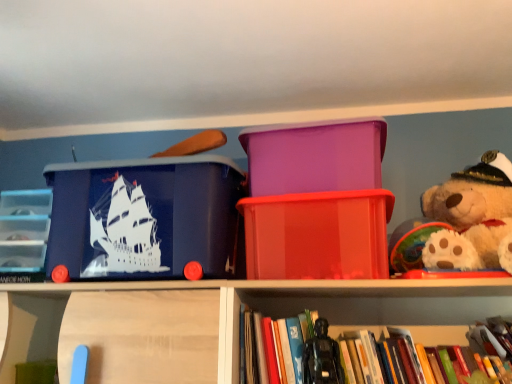
Measure the distance between black plastic action figure at lower center and camera.

The distance of black plastic action figure at lower center from camera is 38.92 inches.

This screenshot has height=384, width=512. Describe the element at coordinates (24, 229) in the screenshot. I see `clear plastic drawers at left` at that location.

In the scene shown: Measure the distance between point (208, 234) and camera.

1.08 meters.

In order to face purple plastic container at center, the second storage box viewed from the right, should I rotate leftwards or rightwards?

You should look right and rotate roughly 8.104 degrees.

Where is `purple plastic container at center, the second storage box positioned from the left`? Image resolution: width=512 pixels, height=384 pixels. purple plastic container at center, the second storage box positioned from the left is located at coordinates (315, 156).

The image size is (512, 384). I want to click on translucent red plastic container at center, the third storage box from the left, so click(x=317, y=235).

From the image's perspective, would you say hardcover book at center is positioned over translucent red plastic container at center, the third storage box from the left?

No.

Is hardcover book at center oriented away from translucent red plastic container at center, the third storage box from the left?

No, hardcover book at center's orientation is not away from translucent red plastic container at center, the third storage box from the left.

Is point (459, 333) closer to camera compared to point (318, 262)?

That is False.

From a real-world perspective, which is physically below, hardcover book at center or matte blue plastic storage box at left, the 1th storage box from the left?

hardcover book at center.

Looking at this image, is hardcover book at center not within matte blue plastic storage box at left, which is counted as the 3th storage box, starting from the right?

Yes, hardcover book at center is outside of matte blue plastic storage box at left, which is counted as the 3th storage box, starting from the right.

Can you tell me how much hardcover book at center and matte blue plastic storage box at left, the 1th storage box from the left, differ in facing direction?

The angular difference between hardcover book at center and matte blue plastic storage box at left, the 1th storage box from the left, is 0.734 degrees.

Is hardcover book at center far from matte blue plastic storage box at left, the 1th storage box from the left?

hardcover book at center is actually quite close to matte blue plastic storage box at left, the 1th storage box from the left.

Does black plastic action figure at lower center have a larger size compared to hardcover book at center?

No.

From a real-world perspective, is black plastic action figure at lower center physically below hardcover book at center?

Correct, in the physical world, black plastic action figure at lower center is lower than hardcover book at center.

Consider the image. Between black plastic action figure at lower center and hardcover book at center, which one appears on the left side from the viewer's perspective?

From the viewer's perspective, black plastic action figure at lower center appears more on the left side.

Is black plastic action figure at lower center positioned with its back to hardcover book at center?

Yes, black plastic action figure at lower center's orientation is away from hardcover book at center.

Between point (312, 355) and point (187, 193), which one is positioned behind?

Positioned behind is point (187, 193).

The width and height of the screenshot is (512, 384). Identify the location of toy below the matte blue plastic storage box at left, which is counted as the 3th storage box, starting from the right (from the image's perspective). (322, 357).

Measure the distance from black plastic action figure at lower center to matte blue plastic storage box at left, the 1th storage box from the left.

The distance of black plastic action figure at lower center from matte blue plastic storage box at left, the 1th storage box from the left, is 19.46 inches.

From a real-world perspective, which is physically below, matte blue plastic storage box at left, which is counted as the 3th storage box, starting from the right, or black plastic action figure at lower center?

black plastic action figure at lower center is physically lower.

Is matte blue plastic storage box at left, which is counted as the 3th storage box, starting from the right, turned away from black plastic action figure at lower center?

That's not correct — matte blue plastic storage box at left, which is counted as the 3th storage box, starting from the right, is not looking away from black plastic action figure at lower center.

Is the surface of matte blue plastic storage box at left, which is counted as the 3th storage box, starting from the right, in direct contact with black plastic action figure at lower center?

No, matte blue plastic storage box at left, which is counted as the 3th storage box, starting from the right, is not beside black plastic action figure at lower center.

Is black plastic action figure at lower center not inside clear plastic drawers at left?

black plastic action figure at lower center lies outside clear plastic drawers at left's area.

From a real-world perspective, is black plastic action figure at lower center located higher than clear plastic drawers at left?

Actually, black plastic action figure at lower center is physically below clear plastic drawers at left in the real world.

Is black plastic action figure at lower center positioned with its back to clear plastic drawers at left?

No.

From the image's perspective, would you say black plastic action figure at lower center is shown under clear plastic drawers at left?

Yes, from the image's perspective, black plastic action figure at lower center is beneath clear plastic drawers at left.

Is clear plastic drawers at left turned away from hardcover book at center?

No, clear plastic drawers at left's orientation is not away from hardcover book at center.

Who is shorter, clear plastic drawers at left or hardcover book at center?

hardcover book at center is shorter.

From a real-world perspective, is clear plastic drawers at left over hardcover book at center?

Indeed, from a real-world perspective, clear plastic drawers at left stands above hardcover book at center.

Is clear plastic drawers at left to the right of hardcover book at center from the viewer's perspective?

Incorrect, clear plastic drawers at left is not on the right side of hardcover book at center.

From a real-world perspective, which storage box is the 1st one above the hardcover book at center? Please provide its 2D coordinates.

[(317, 235)]

Image resolution: width=512 pixels, height=384 pixels. Identify the location of the 3rd storage box to the left of the hardcover book at center, starting your count from the anchor. (144, 217).

Based on their spatial positions, is matte blue plastic storage box at left, which is counted as the 3th storage box, starting from the right, or translucent red plastic container at center, the third storage box from the left, closer to purple plastic container at center, the second storage box positioned from the left?

translucent red plastic container at center, the third storage box from the left, is positioned closer to the anchor purple plastic container at center, the second storage box positioned from the left.

Consider the image. Considering their positions, is translucent red plastic container at center, the third storage box from the left, positioned closer to clear plastic drawers at left than purple plastic container at center, the second storage box viewed from the right?

Among the two, translucent red plastic container at center, the third storage box from the left, is located nearer to clear plastic drawers at left.

From the image, which object appears to be farther from hardcover book at center, purple plastic container at center, the second storage box positioned from the left, or matte blue plastic storage box at left, the 1th storage box from the left?

matte blue plastic storage box at left, the 1th storage box from the left, is further to hardcover book at center.

Which object lies further to the anchor point matte blue plastic storage box at left, which is counted as the 3th storage box, starting from the right, purple plastic container at center, the second storage box viewed from the right, or hardcover book at center?

Based on the image, hardcover book at center appears to be further to matte blue plastic storage box at left, which is counted as the 3th storage box, starting from the right.

Which object lies nearer to the anchor point matte blue plastic storage box at left, the 1th storage box from the left, black plastic action figure at lower center or translucent red plastic container at center, the third storage box from the left?

The object closer to matte blue plastic storage box at left, the 1th storage box from the left, is translucent red plastic container at center, the third storage box from the left.

Based on their spatial positions, is purple plastic container at center, the second storage box positioned from the left, or translucent red plastic container at center, the third storage box from the left, further from hardcover book at center?

purple plastic container at center, the second storage box positioned from the left, lies further to hardcover book at center than the other object.

When comparing their distances from translucent red plastic container at center, marked as the 1th storage box in a right-to-left arrangement, does clear plastic drawers at left or purple plastic container at center, the second storage box viewed from the right, seem closer?

purple plastic container at center, the second storage box viewed from the right, is closer to translucent red plastic container at center, marked as the 1th storage box in a right-to-left arrangement.

Looking at the image, which one is located further to clear plastic drawers at left, hardcover book at center or purple plastic container at center, the second storage box positioned from the left?

hardcover book at center is further to clear plastic drawers at left.

This screenshot has height=384, width=512. I want to click on storage box between clear plastic drawers at left and purple plastic container at center, the second storage box viewed from the right, in the horizontal direction, so tap(144, 217).

Locate an element on the screen. The height and width of the screenshot is (384, 512). book between translucent red plastic container at center, marked as the 1th storage box in a right-to-left arrangement, and black plastic action figure at lower center from top to bottom is located at coordinates (435, 335).

Where is `toy between clear plastic drawers at left and translucent red plastic container at center, marked as the 1th storage box in a right-to-left arrangement`? The width and height of the screenshot is (512, 384). toy between clear plastic drawers at left and translucent red plastic container at center, marked as the 1th storage box in a right-to-left arrangement is located at coordinates (322, 357).

Where is `storage box between matte blue plastic storage box at left, which is counted as the 3th storage box, starting from the right, and translucent red plastic container at center, marked as the 1th storage box in a right-to-left arrangement`? The height and width of the screenshot is (384, 512). storage box between matte blue plastic storage box at left, which is counted as the 3th storage box, starting from the right, and translucent red plastic container at center, marked as the 1th storage box in a right-to-left arrangement is located at coordinates (315, 156).